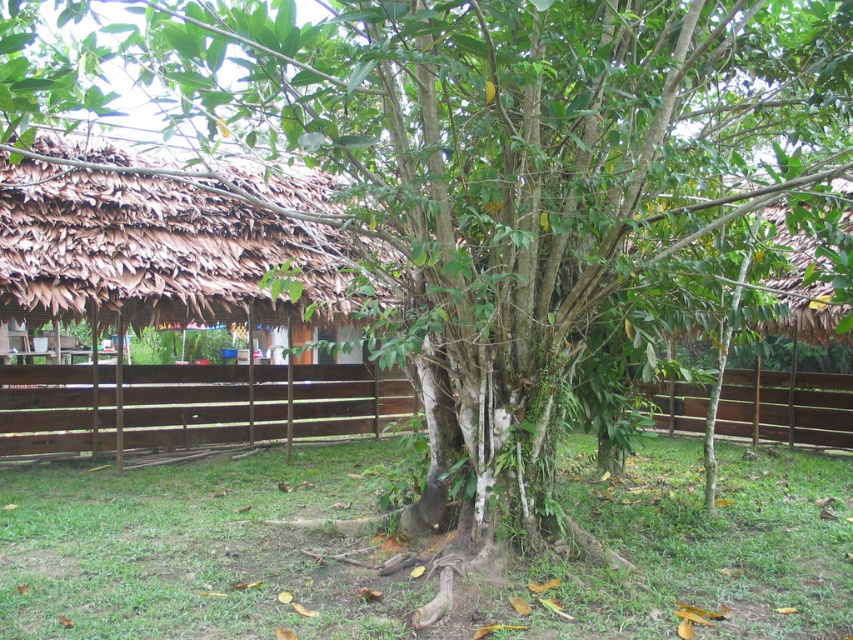
Looking at this image, you are a painter standing in front of the brown wooden fence at center and the brown thatched hut at upper right. You want to paint both objects but need to know which one is shorter. Which object should you look down at more to paint?

The brown wooden fence at center is shorter than the brown thatched hut at upper right, so you should look down more at the brown wooden fence at center to paint it.

You are planning to place a new bench in the garden. The bench requires a space that is wider than the brown thatched hut at upper right. Based on the scene, is the brown wooden fence at center a suitable location for the bench?

The brown wooden fence at center might be wider than brown thatched hut at upper right, so it could be a suitable location for the bench if the required space is met.

You are planning to set up a tent in the outdoor scene. The tent requires a flat area with grass height less than the brown thatched hut at upper right. Based on the scene, can you confirm if the green grass at center is suitable for setting up the tent?

The green grass at center has a lesser height compared to the brown thatched hut at upper right, so it is suitable for setting up the tent as it meets the requirement of having grass height less than the brown thatched hut at upper right.